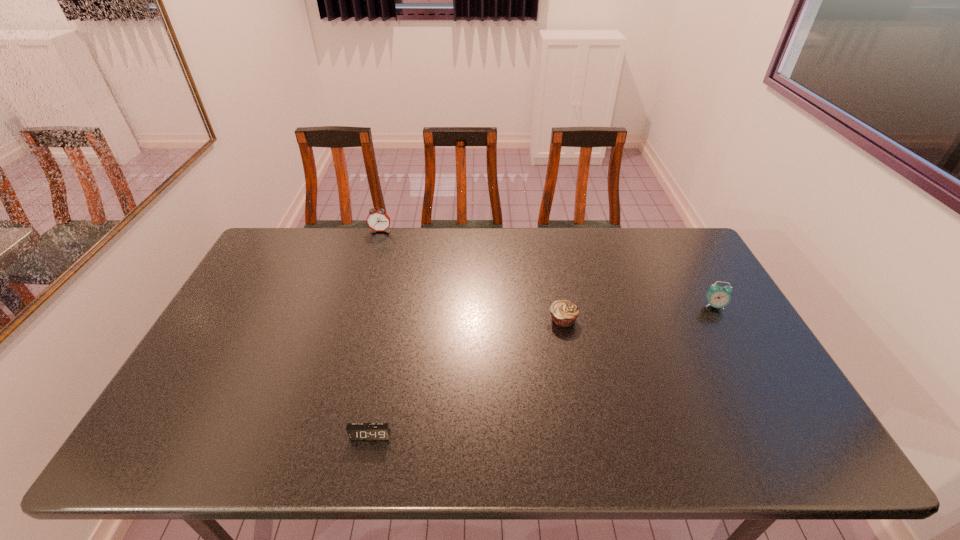
Locate an element on the screen. the leftmost alarm clock is located at coordinates (377, 220).

This screenshot has width=960, height=540. Identify the location of the farthest alarm clock. (377, 220).

Where is `the second tallest object`? the second tallest object is located at coordinates (718, 297).

Identify the location of the second tallest alarm clock. (718, 297).

What are the coordinates of `the third object from left to right` in the screenshot? It's located at (564, 313).

In order to click on the second shortest object in this screenshot , I will do `click(564, 313)`.

Where is `the second alarm clock from left to right`? the second alarm clock from left to right is located at coordinates (356, 431).

Locate an element on the screen. This screenshot has height=540, width=960. the nearest object is located at coordinates (356, 431).

In order to click on vacant area situated 0.100m on the clock face of the leftmost alarm clock in this screenshot , I will do `click(374, 250)`.

The height and width of the screenshot is (540, 960). I want to click on free space located on the face of the third shortest object, so click(742, 355).